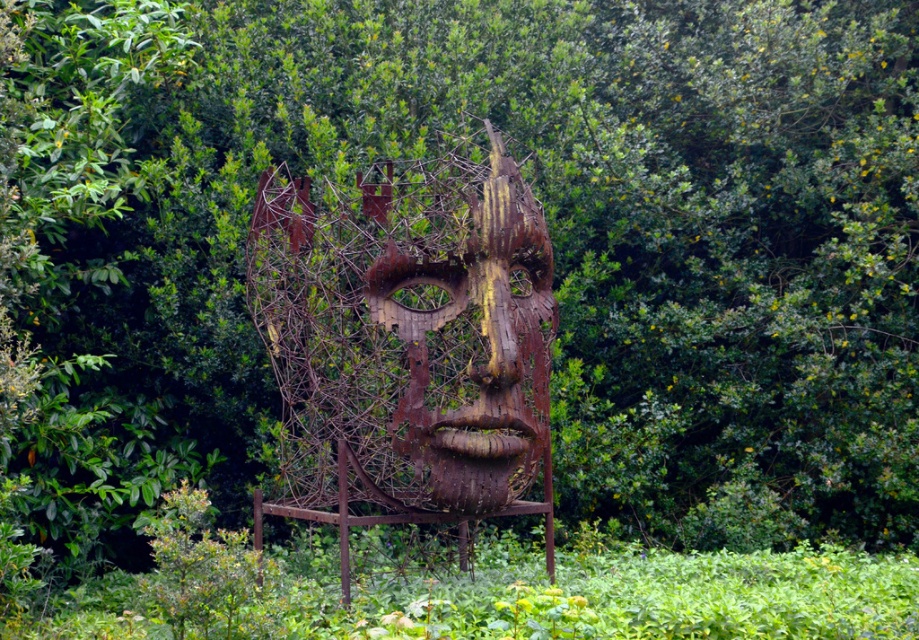
Which is behind, point (479, 339) or point (506, 342)?

The point (479, 339) is behind.

Consider the image. Is rusty wire mesh face at center taller than rusty metal face at center?

Yes.

What do you see at coordinates (407, 340) in the screenshot? The height and width of the screenshot is (640, 919). I see `rusty wire mesh face at center` at bounding box center [407, 340].

Locate an element on the screen. rusty wire mesh face at center is located at coordinates (407, 340).